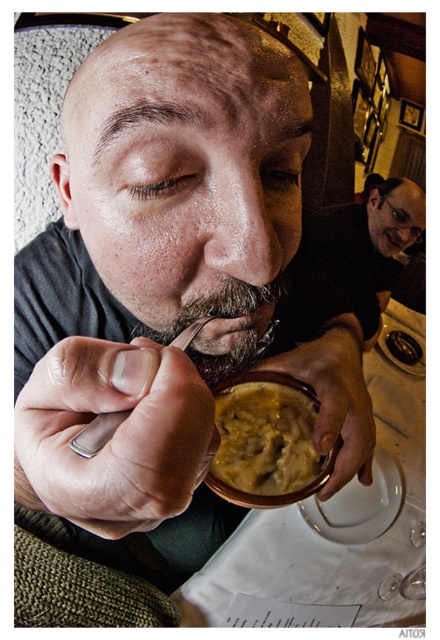
The width and height of the screenshot is (440, 640). What do you see at coordinates (341, 518) in the screenshot? I see `white paper at lower center` at bounding box center [341, 518].

Does white paper at lower center appear on the left side of silver metallic spoon at lower center?

In fact, white paper at lower center is to the right of silver metallic spoon at lower center.

Image resolution: width=440 pixels, height=640 pixels. I want to click on white paper at lower center, so click(341, 518).

Is white paper at lower center to the right of dark brown fuzzy beard at lower center from the viewer's perspective?

Yes, white paper at lower center is to the right of dark brown fuzzy beard at lower center.

Does white paper at lower center have a lesser width compared to dark brown fuzzy beard at lower center?

Incorrect, white paper at lower center's width is not less than dark brown fuzzy beard at lower center's.

The image size is (440, 640). I want to click on white paper at lower center, so click(341, 518).

Is point (286, 422) more distant than point (216, 339)?

Yes, point (286, 422) is farther from viewer.

The height and width of the screenshot is (640, 440). Identify the location of yellow creamy food at center. (266, 444).